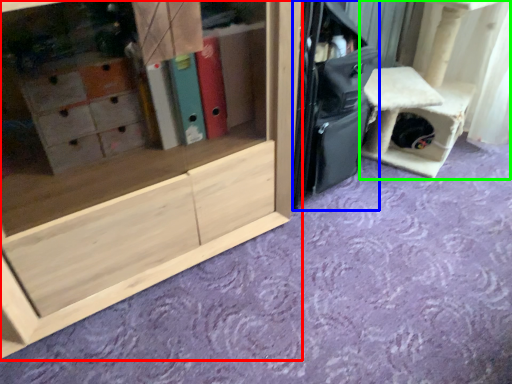
Question: Which object is positioned farthest from cabinetry (highlighted by a red box)? Select from luggage (highlighted by a blue box) and furniture (highlighted by a green box).

Choices:
 (A) luggage
 (B) furniture

Answer: (B)